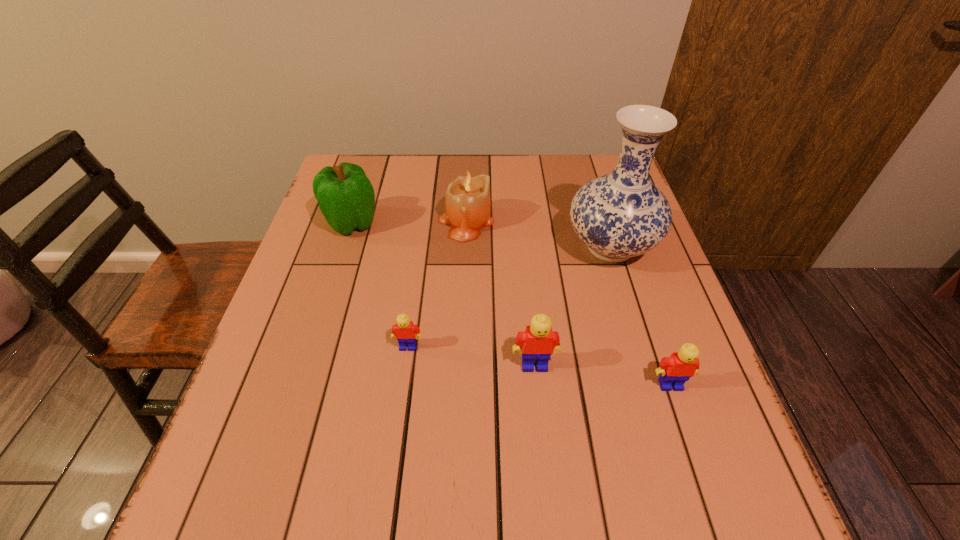
The height and width of the screenshot is (540, 960). I want to click on vacant place for an extra Lego on the left, so click(x=290, y=329).